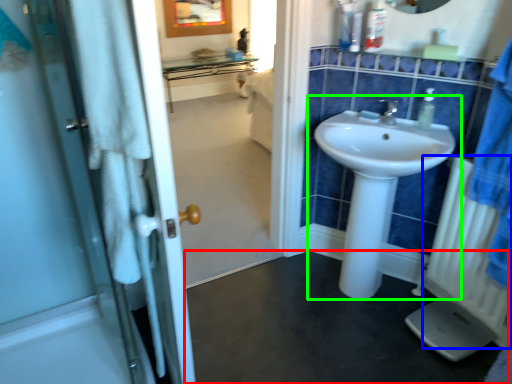
Question: Estimate the real-world distances between objects in this image. Which object is farther from plain (highlighted by a red box), radiator (highlighted by a blue box) or sink (highlighted by a green box)?

Choices:
 (A) radiator
 (B) sink

Answer: (A)